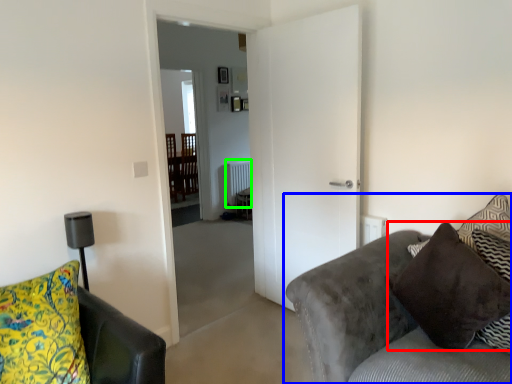
Question: Which object is positioned closest to pillow (highlighted by a red box)? Select from studio couch (highlighted by a blue box) and radiator (highlighted by a green box).

Choices:
 (A) studio couch
 (B) radiator

Answer: (A)